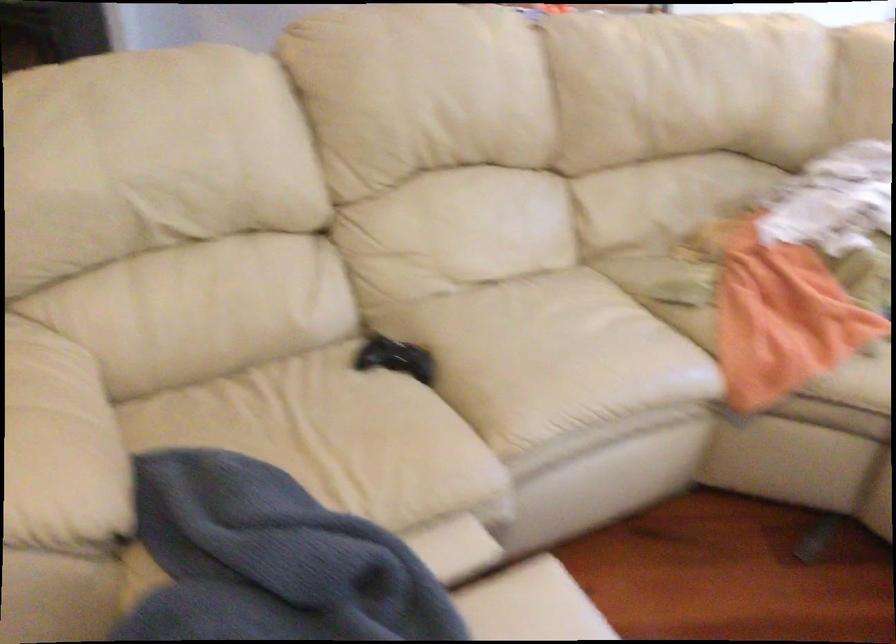
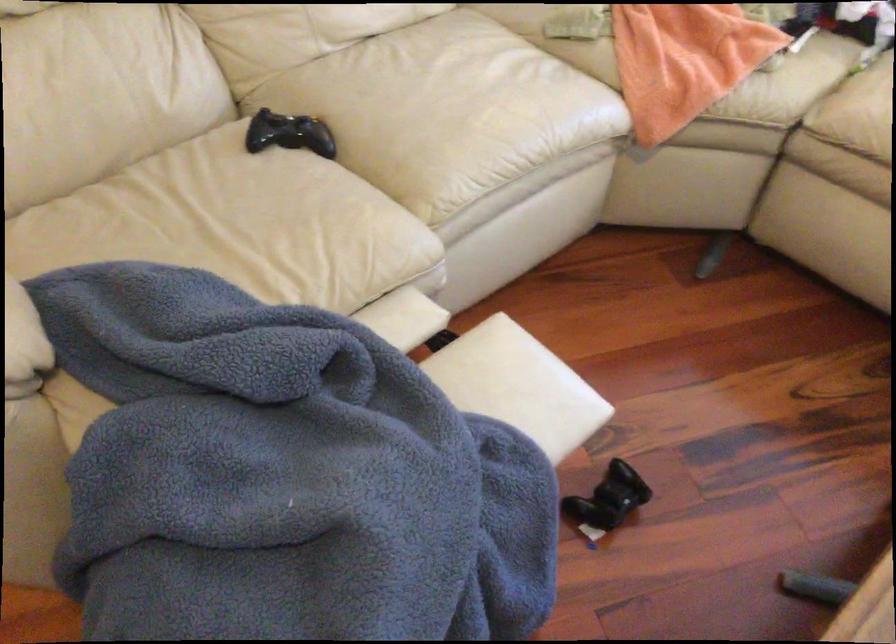
Where in the second image is the point corresponding to point (544, 351) from the first image?

(446, 109)